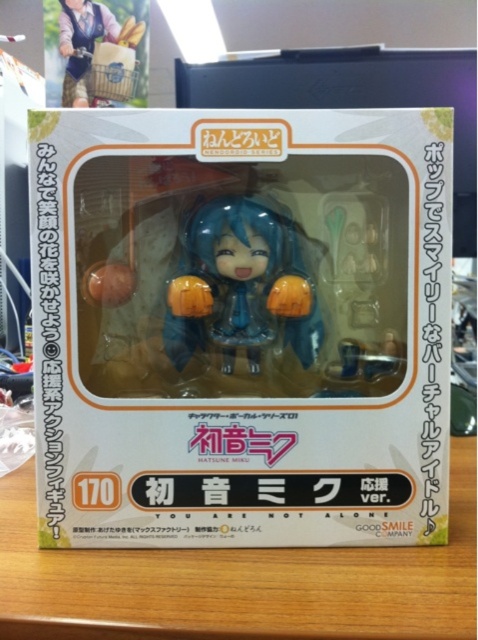
You are organizing a display shelf and have both the white matte box at center and the matte brown wooden basket at upper left. If you want to stack them vertically, which one should you place at the bottom to ensure stability?

You should place the white matte box at center at the bottom because it has a greater height than the matte brown wooden basket at upper left, providing a more stable base for stacking.

Consider the image. You are placing the white matte box at center onto the yellow matte table at center. Based on the scene description, will the box fit on the table without overhanging the edges?

The white matte box at center is above the yellow matte table at center, so it is already placed on the table and does not overhang the edges.

You are holding the packaging box of the Nendoroid Hatsune Miku figurine. You want to place the matte brown wooden basket at upper left on a shelf next to the matte blue figure at center. Since both items are in the box, which one should you remove first to access the other?

The matte blue figure at center is closer to the viewer than the matte brown wooden basket at upper left, so you should remove the matte blue figure at center first to access the matte brown wooden basket at upper left.